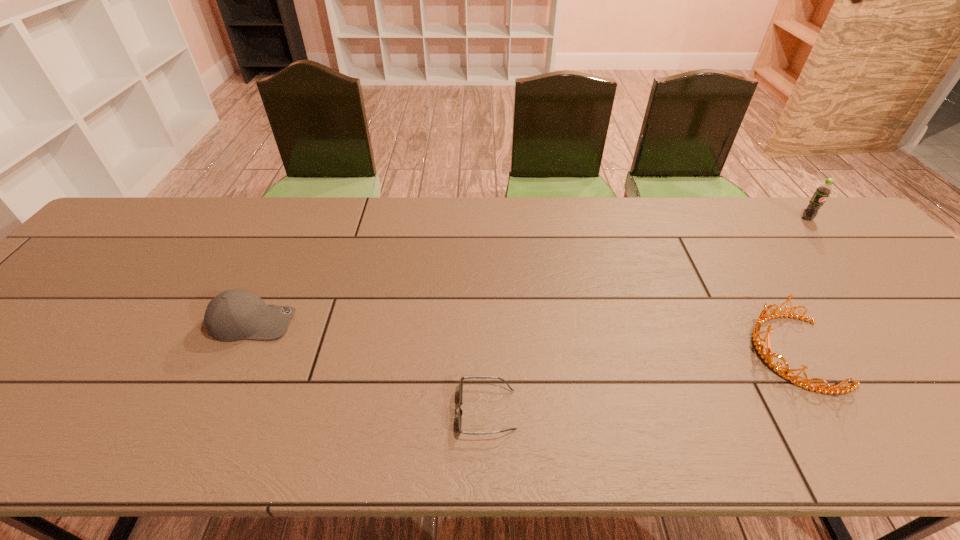
This screenshot has height=540, width=960. Identify the location of soda. (822, 192).

I want to click on the farthest object, so click(822, 192).

Identify the location of tiara. (767, 357).

Where is `baseball cap`? The image size is (960, 540). baseball cap is located at coordinates (232, 315).

Identify the location of sunglasses. (460, 412).

What are the coordinates of `the shortest object` in the screenshot? It's located at (460, 412).

Image resolution: width=960 pixels, height=540 pixels. In order to click on free location located 0.280m on the front label of the soda in this screenshot , I will do `click(868, 287)`.

Locate an element on the screen. The height and width of the screenshot is (540, 960). vacant space positioned on the front-facing side of the tiara is located at coordinates click(614, 352).

This screenshot has height=540, width=960. I want to click on vacant space located 0.060m on the front-facing side of the tiara, so click(725, 352).

Identify the location of free space located 0.170m on the front-facing side of the tiara. The height and width of the screenshot is (540, 960). (676, 352).